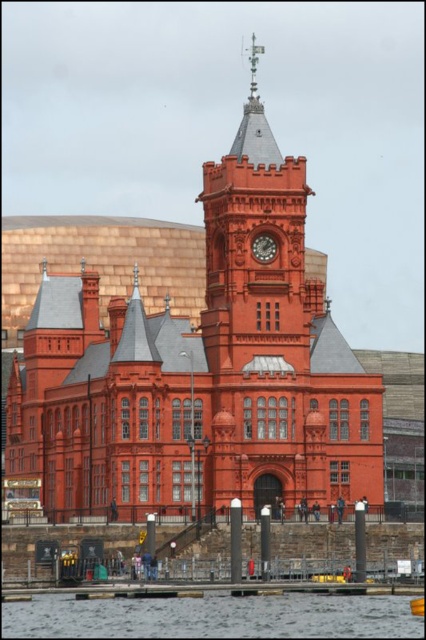
Between transparent water at lower center and matte red clock at center, which one is positioned higher?

matte red clock at center

Measure the distance from transparent water at lower center to matte red clock at center.

They are 78.96 feet apart.

Is point (362, 611) positioned after point (259, 248)?

No, (362, 611) is closer to viewer.

This screenshot has height=640, width=426. What are the coordinates of `transparent water at lower center` in the screenshot? It's located at (213, 616).